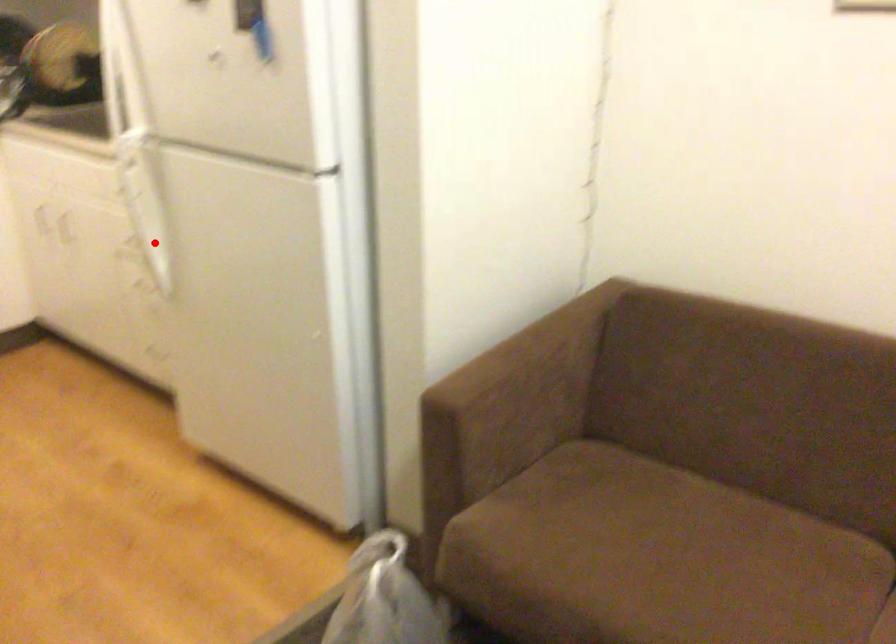
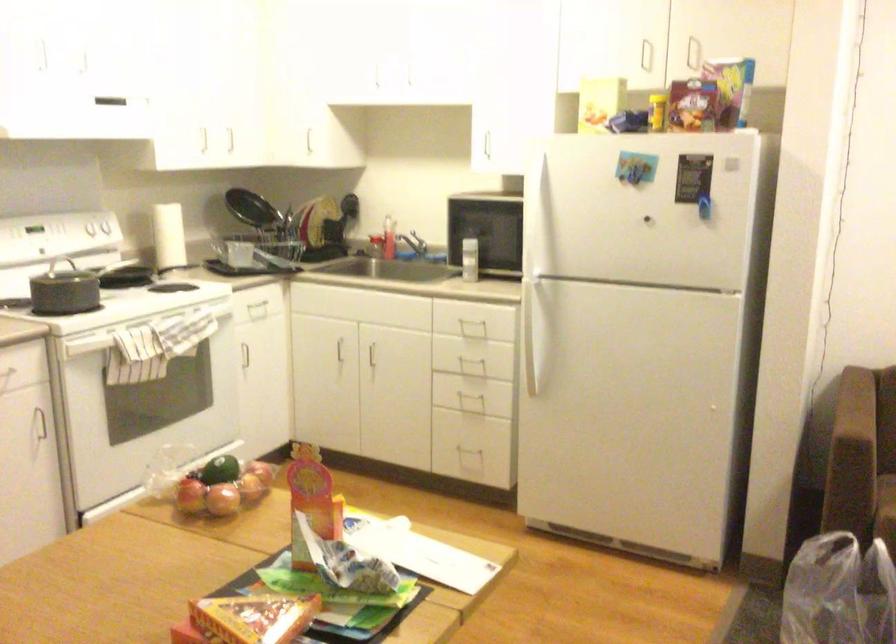
Locate, in the second image, the point that corresponds to the highlighted location in the first image.

(536, 350)